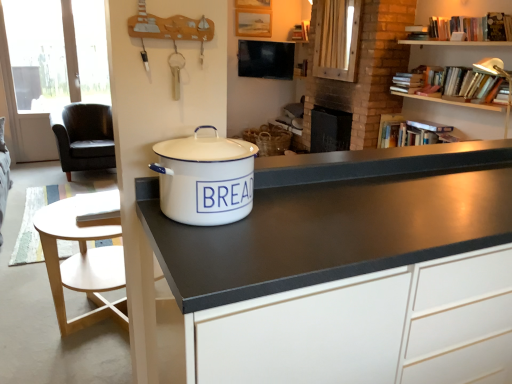
Where is `free space in front of white enamel bread bin at center`? free space in front of white enamel bread bin at center is located at coordinates (224, 256).